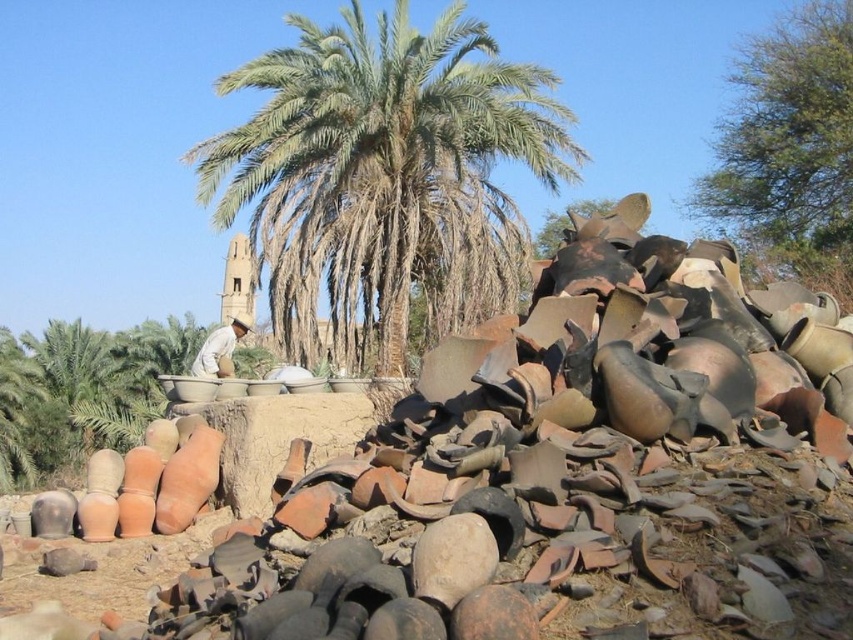
You are standing at the origin point of the coordinate system. There are two points marked in the scene, point A at point (468, 166) and point B at point (212, 369). Which point is closer to you?

Point B at point (212, 369) is closer to you because it is in front of point A at point (468, 166).

You are standing at the center of the scene. Which direction should you look to see the green leafy palm tree at center?

The green leafy palm tree at center is located at point (x=384, y=176), which is slightly to the left and above the center point. So you should look slightly to the left and upward from the center to see it.